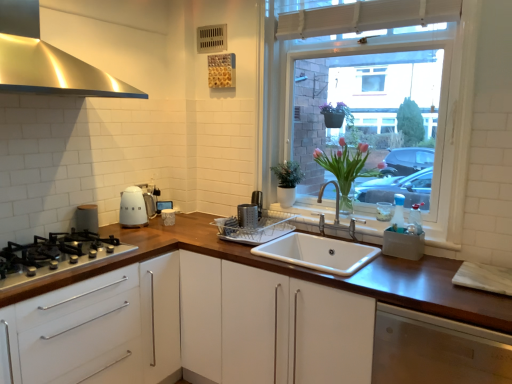
Locate an element on the screen. blank space above matte white kettle at left, which appears as the 2th appliance when viewed from the right (from a real-world perspective) is located at coordinates (134, 188).